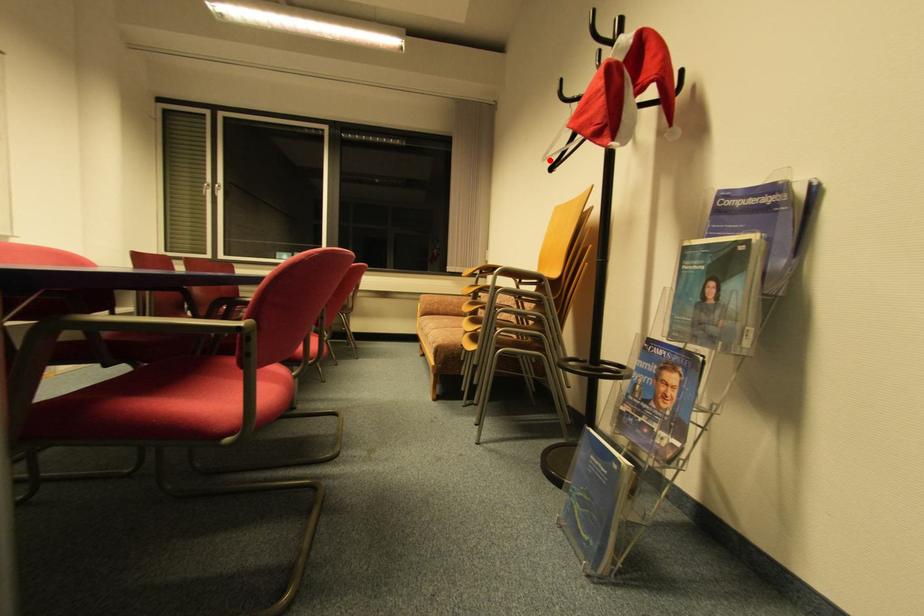
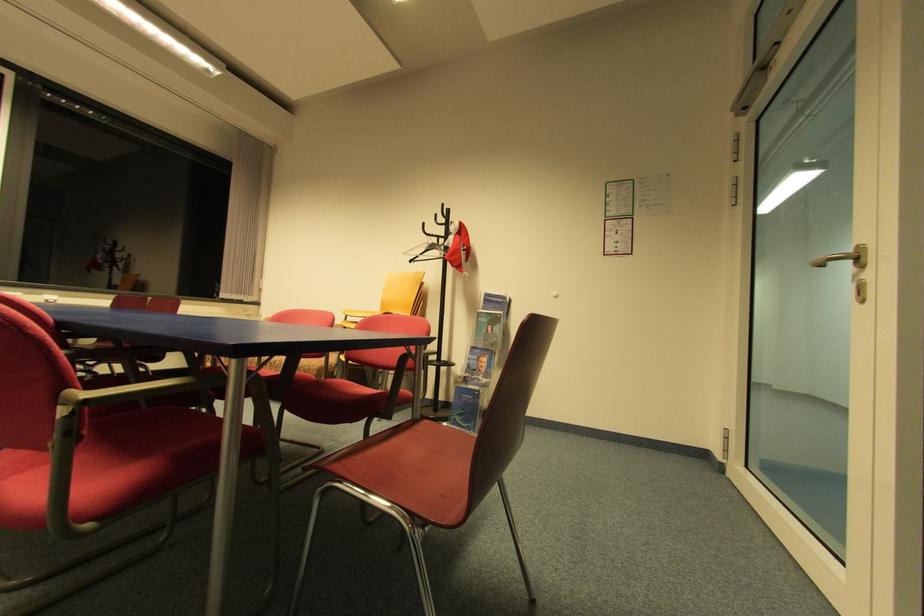
The point at the highlighted location is marked in the first image. Where is the corresponding point in the second image?

(408, 254)